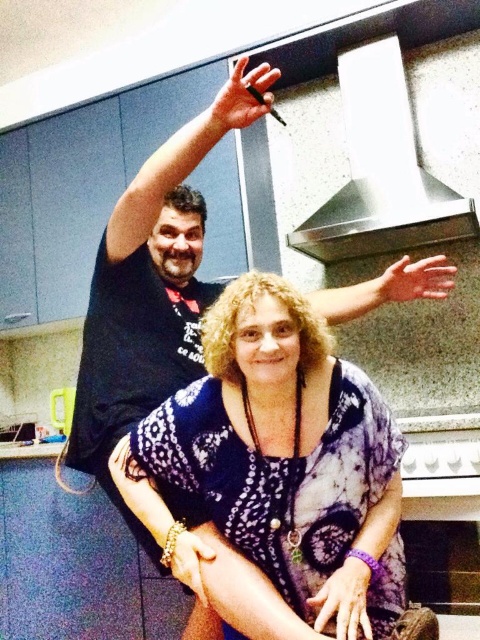
Question: Can you confirm if matte black pen at upper center is smaller than white glossy counter top at lower left?

Choices:
 (A) no
 (B) yes

Answer: (B)

Question: Which of the following is the closest to the observer?

Choices:
 (A) smooth skin arm at center
 (B) matte black pen at upper center

Answer: (B)

Question: Is smooth skin arm at center smaller than dry skin at upper center?

Choices:
 (A) yes
 (B) no

Answer: (B)

Question: Which object appears farthest from the camera in this image?

Choices:
 (A) black matte oven at lower right
 (B) white glossy counter top at lower left
 (C) dry skin at upper center

Answer: (B)

Question: Which point is farther from the camera taking this photo?

Choices:
 (A) (357, 289)
 (B) (409, 278)

Answer: (A)

Question: Is stainless steel exhaust hood at upper center further to camera compared to black matte oven at lower right?

Choices:
 (A) yes
 (B) no

Answer: (A)